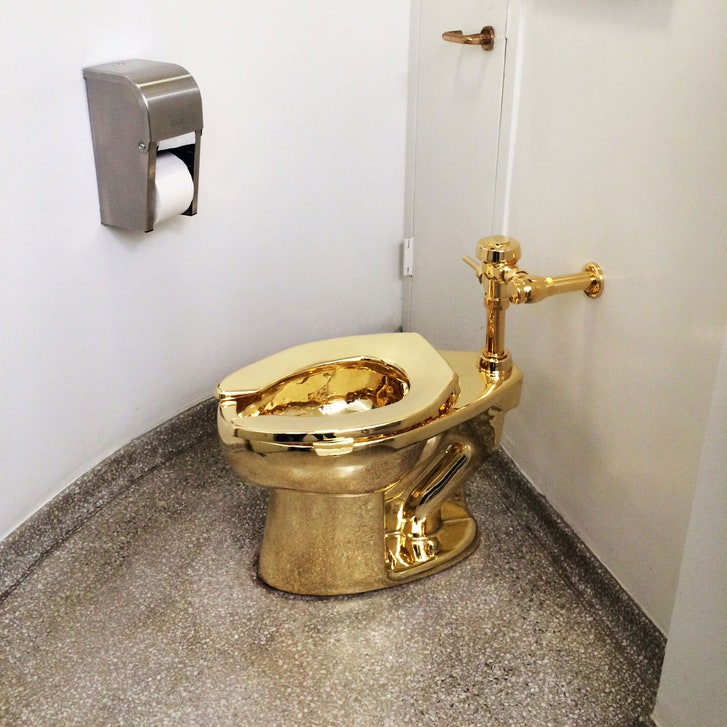
You are a GUI agent. You are given a task and a screenshot of the screen. Output one action in this format:
    pyautogui.click(x=<x>, y=<y>)
    Task: Click on the toilet roll
    The image size is (727, 727).
    Given the screenshot: What is the action you would take?
    pyautogui.click(x=172, y=198)